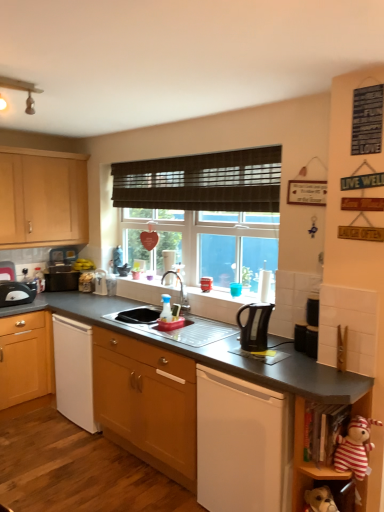
Where is `free space in front of black plastic kettle at center, which is counted as the 1th appliance, starting from the right`? free space in front of black plastic kettle at center, which is counted as the 1th appliance, starting from the right is located at coordinates (304, 359).